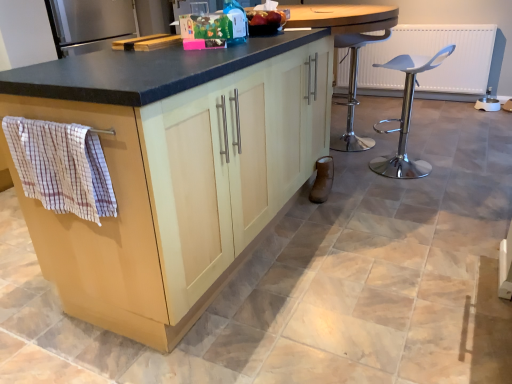
This screenshot has height=384, width=512. What are the coordinates of `vacant area to the left of white plastic stool at right` in the screenshot? It's located at (354, 173).